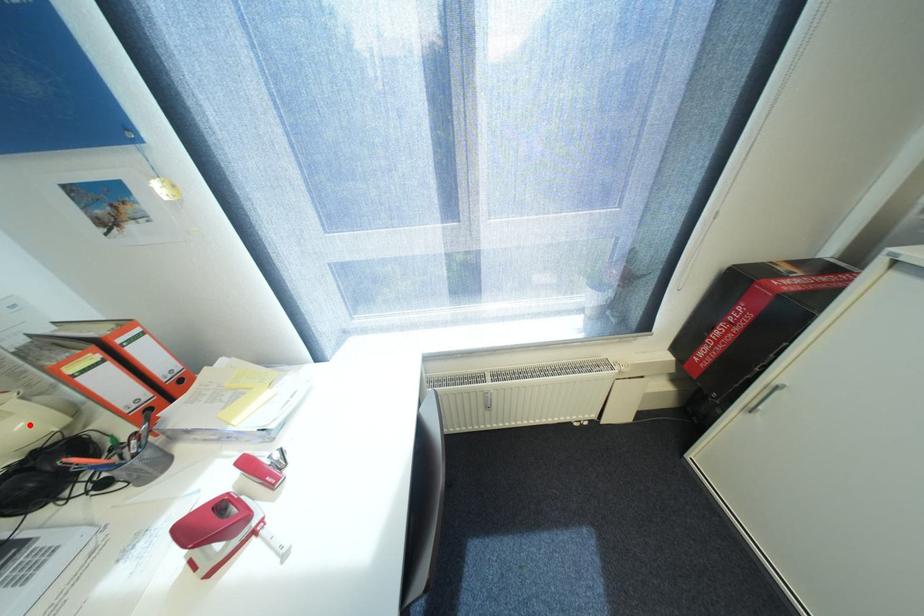
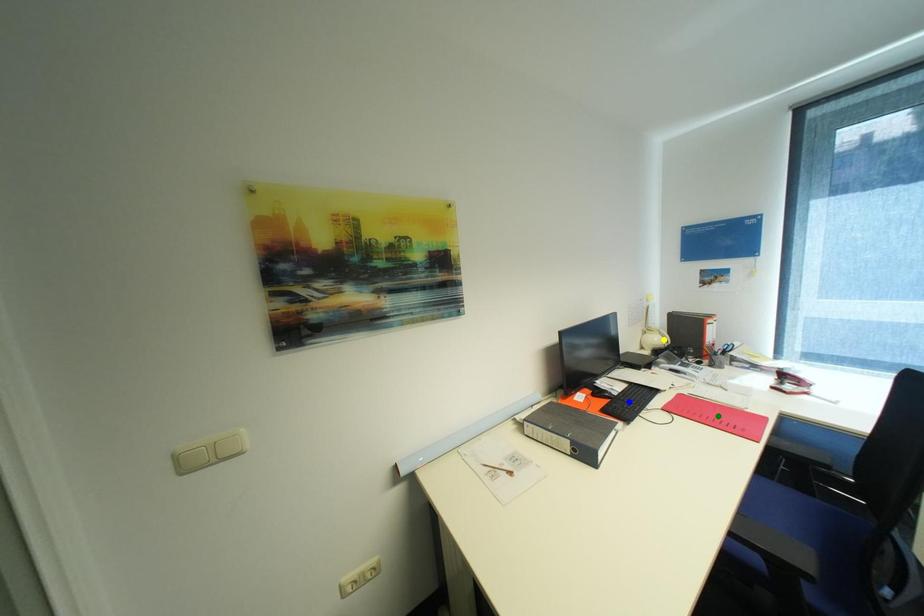
Question: I am providing you with two images of the same scene from different viewpoints. A red point is marked on the first image. You are given multiple points on the second image. Can you choose the point in image 2 that corresponds to the point in image 1?

Choices:
 (A) blue point
 (B) yellow point
 (C) green point

Answer: (B)